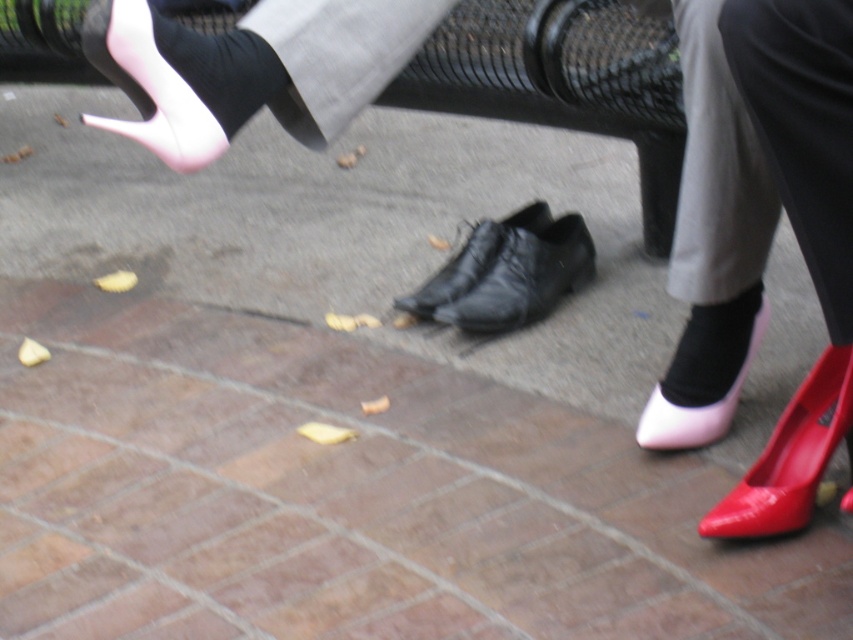
Which of these two, glossy patent shoe at lower right or black smooth sock at lower right, stands taller?

With more height is glossy patent shoe at lower right.

Who is more forward, (790, 438) or (724, 305)?

Positioned in front is point (790, 438).

Find the location of a particular element. glossy patent shoe at lower right is located at coordinates (791, 456).

Based on the photo, can you confirm if glossy patent shoe at lower right is positioned below matte pink high-heeled shoe at upper left?

→ Correct, glossy patent shoe at lower right is located below matte pink high-heeled shoe at upper left.

Is glossy patent shoe at lower right smaller than matte pink high-heeled shoe at upper left?

No, glossy patent shoe at lower right is not smaller than matte pink high-heeled shoe at upper left.

The height and width of the screenshot is (640, 853). What do you see at coordinates (791, 456) in the screenshot?
I see `glossy patent shoe at lower right` at bounding box center [791, 456].

Locate an element on the screen. The image size is (853, 640). glossy patent shoe at lower right is located at coordinates (791, 456).

Between matte pink high-heeled shoe at upper left and black smooth sock at lower right, which one has more height?

Standing taller between the two is matte pink high-heeled shoe at upper left.

Between matte pink high-heeled shoe at upper left and black smooth sock at lower right, which one appears on the right side from the viewer's perspective?

black smooth sock at lower right

Measure the distance between matte pink high-heeled shoe at upper left and camera.

They are 1.04 meters apart.

Find the location of a particular element. Image resolution: width=853 pixels, height=640 pixels. matte pink high-heeled shoe at upper left is located at coordinates (149, 88).